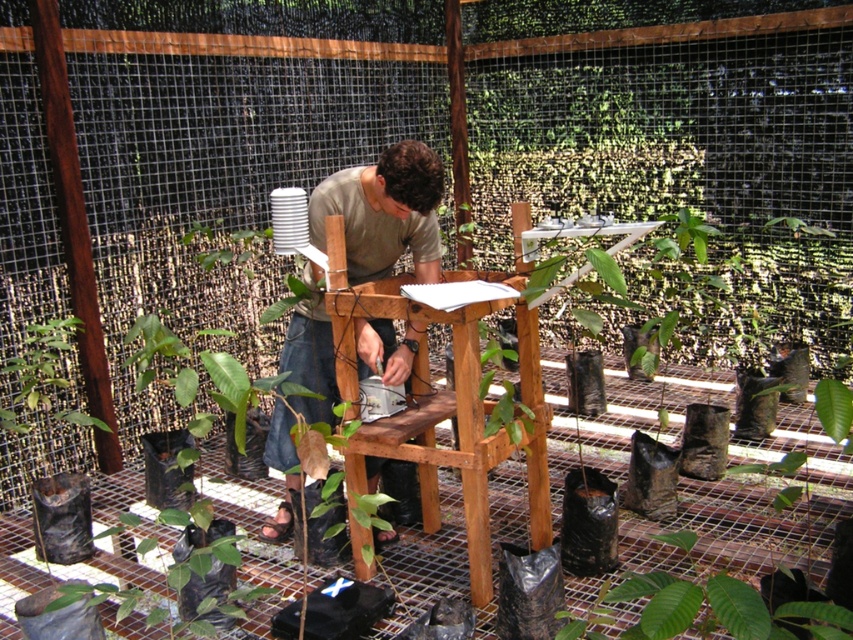
In the scene shown: Who is higher up, light brown wood man at center or green matte plant at lower right?

Positioned higher is light brown wood man at center.

Is point (364, 340) behind point (706, 618)?

That is True.

Identify the location of light brown wood man at center. This screenshot has width=853, height=640. (384, 212).